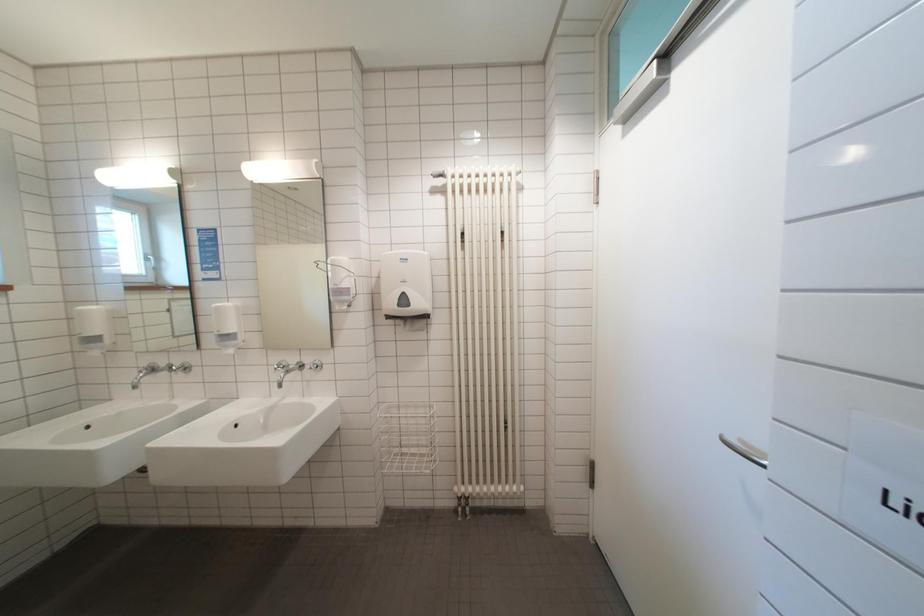
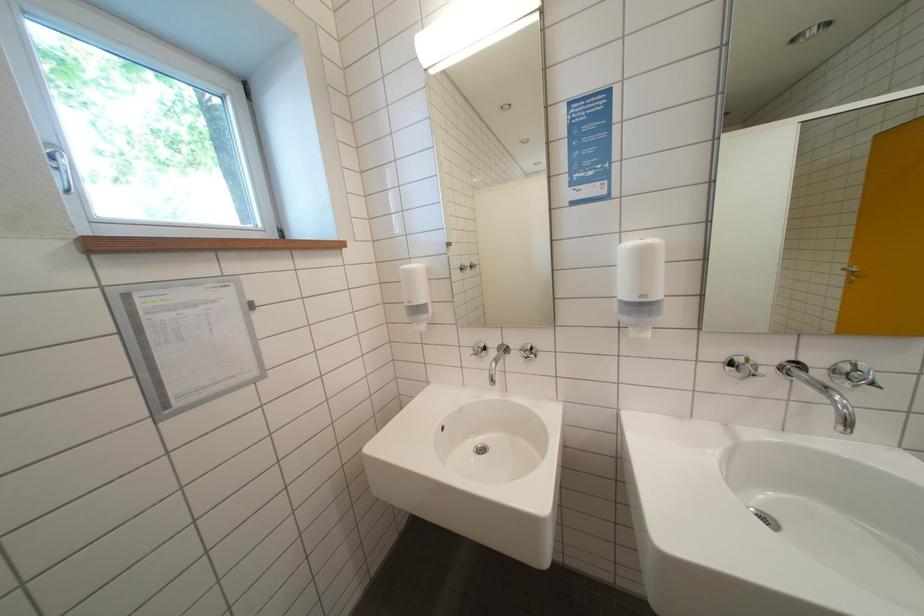
Question: In a continuous first-person perspective shot, in which direction is the camera moving?

Choices:
 (A) Left
 (B) Right
 (C) Forward
 (D) Backward

Answer: (A)